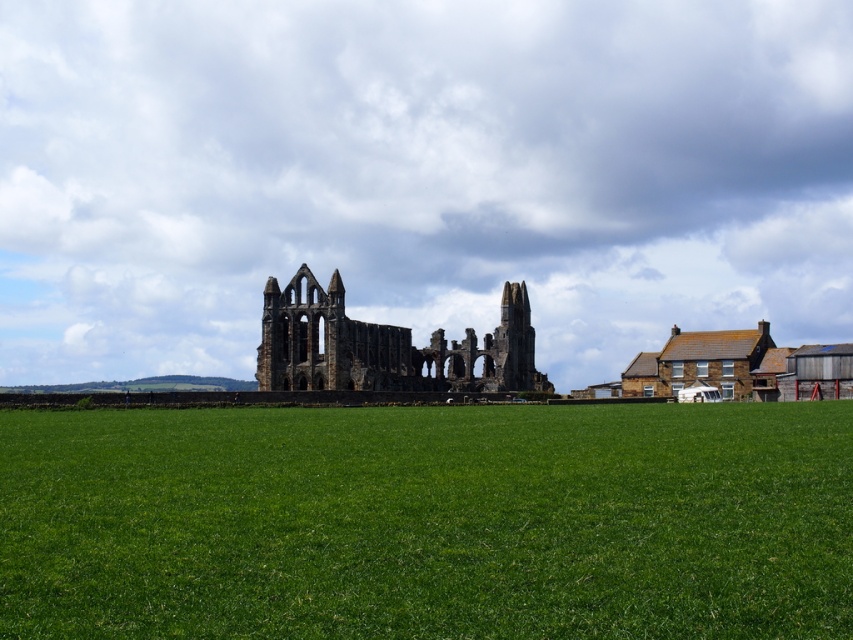
Is point (706, 500) in front of point (280, 317)?

That is True.

Between green grass at center and stone ruins at center, which one has less height?

green grass at center

Which is behind, point (666, 621) or point (268, 388)?

Point (268, 388)

The width and height of the screenshot is (853, 640). What are the coordinates of `green grass at center` in the screenshot? It's located at (427, 522).